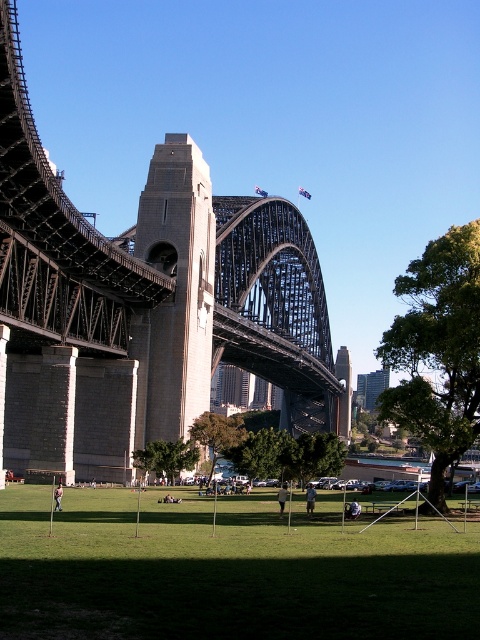
You are standing in the park area of the Sydney Harbour Bridge scene. There are two points marked in the image. One is at coordinates point [64,200] and the other is at point [348,509]. Which point is nearer to you?

Point [64,200] is closer to the viewer than point [348,509].

You are a photographer planning to capture a group photo of two people wearing the white cotton shirt at center and the light brown fabric shirt at center. If you want to ensure both shirts are fully visible in the frame, which person should you position closer to the camera?

The photographer should position the person wearing the light brown fabric shirt at center closer to the camera because the white cotton shirt at center might be wider, requiring more space in the frame to ensure full visibility.

Based on the photo, you are a photographer standing in the park and want to capture both the dark gray steel bridge at center and the dark blue jeans at center in a single photo. Which object should you focus on first to ensure both are in frame?

The dark gray steel bridge at center is taller than the dark blue jeans at center, so you should focus on the dark gray steel bridge at center first to ensure both are in frame.